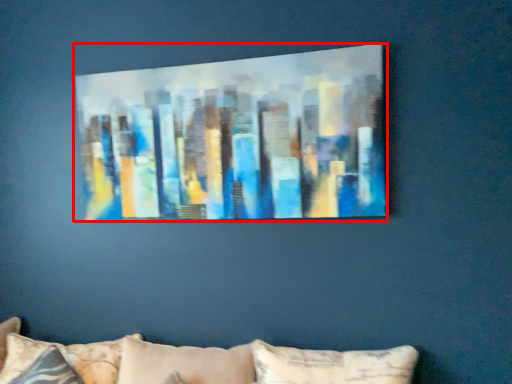
Question: From the image's perspective, considering the relative positions of picture frame (annotated by the red box) and pillow in the image provided, where is picture frame (annotated by the red box) located with respect to the staircase?

Choices:
 (A) above
 (B) below

Answer: (A)